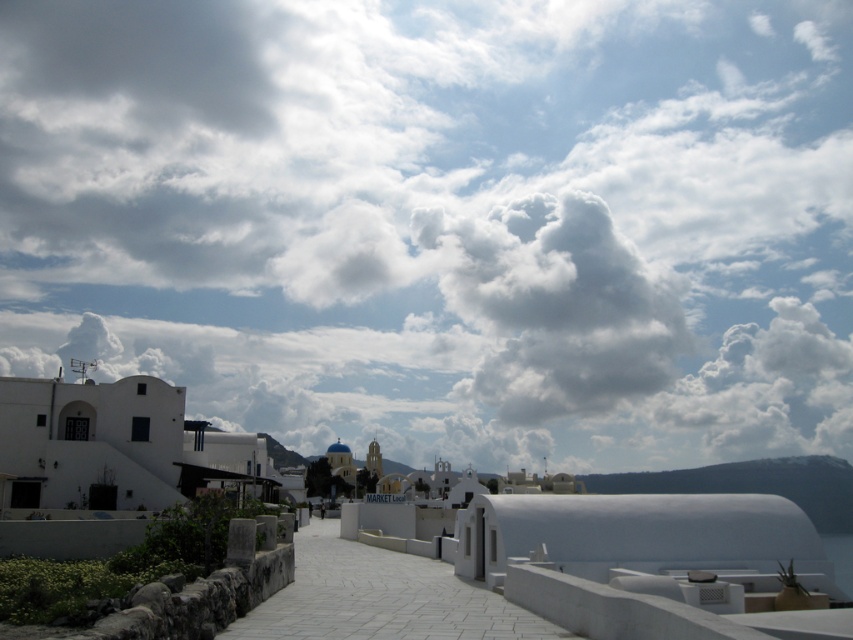
Is white fluffy cloud at upper center thinner than white stone path at center?

Incorrect, white fluffy cloud at upper center's width is not less than white stone path at center's.

Which is behind, point (59, 349) or point (404, 614)?

The point (59, 349) is more distant.

What do you see at coordinates (444, 220) in the screenshot? I see `white fluffy cloud at upper center` at bounding box center [444, 220].

Locate an element on the screen. The width and height of the screenshot is (853, 640). white fluffy cloud at upper center is located at coordinates (444, 220).